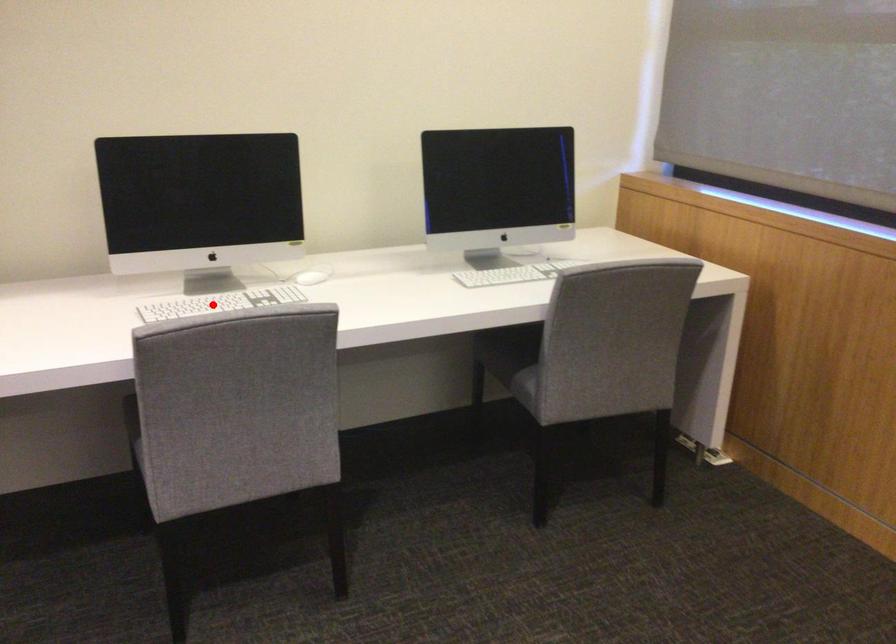
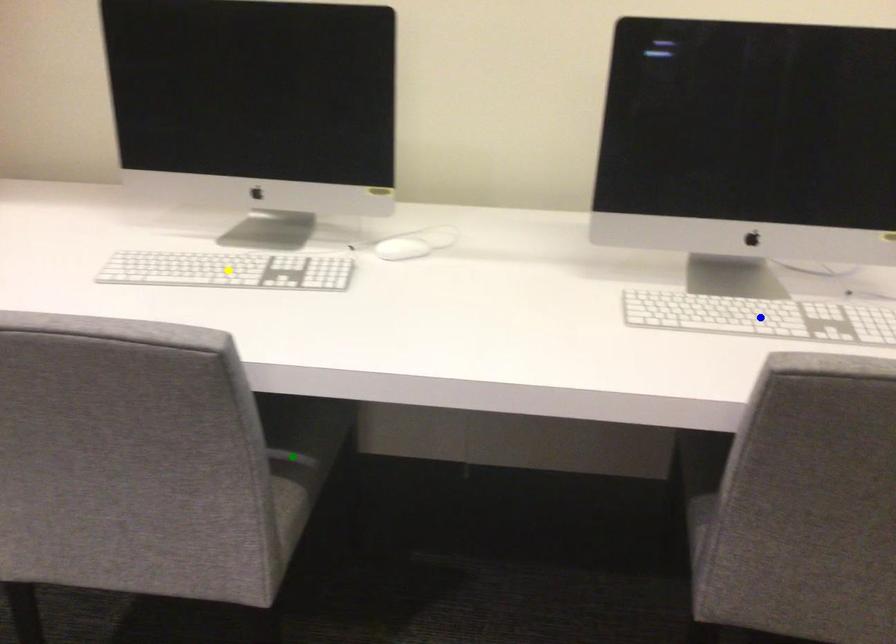
Question: I am providing you with two images of the same scene from different viewpoints. A red point is marked on the first image. You are given multiple points on the second image. Which point in image 2 is actually the same real-world point as the red point in image 1?

Choices:
 (A) green point
 (B) yellow point
 (C) blue point

Answer: (B)